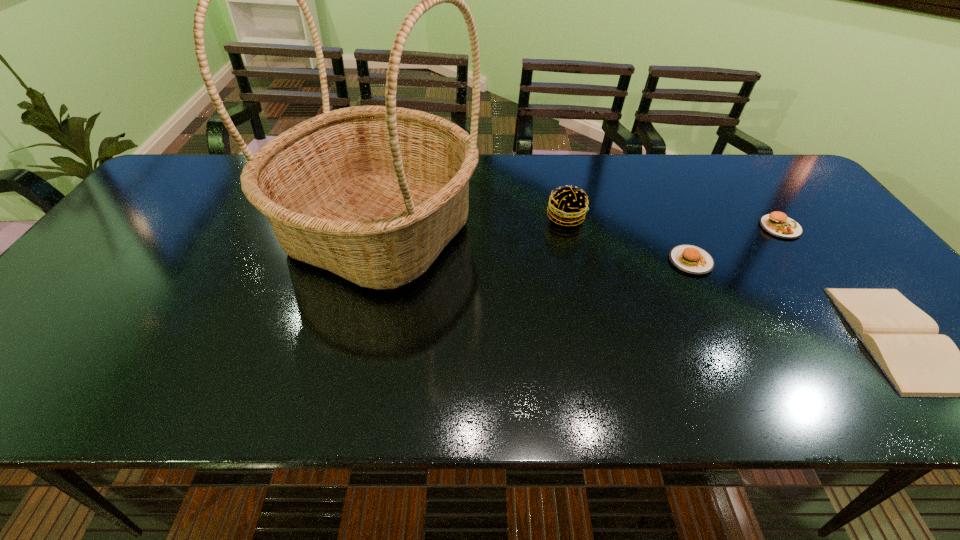
Identify the location of free space that satisfies the following two spatial constraints: 1. on the back side of the fourth object from right to left; 2. on the right side of the basket. (382, 217).

Where is `vacant space that satisfies the following two spatial constraints: 1. on the front side of the tallest object; 2. on the left side of the second food from left to right`? The height and width of the screenshot is (540, 960). vacant space that satisfies the following two spatial constraints: 1. on the front side of the tallest object; 2. on the left side of the second food from left to right is located at coordinates (372, 261).

You are a GUI agent. You are given a task and a screenshot of the screen. Output one action in this format:
    pyautogui.click(x=<x>, y=<y>)
    Task: Click on the free spot that satisfies the following two spatial constraints: 1. on the back side of the rightmost food; 2. on the left side of the tallest object
    This screenshot has width=960, height=540.
    Given the screenshot: What is the action you would take?
    pyautogui.click(x=380, y=227)